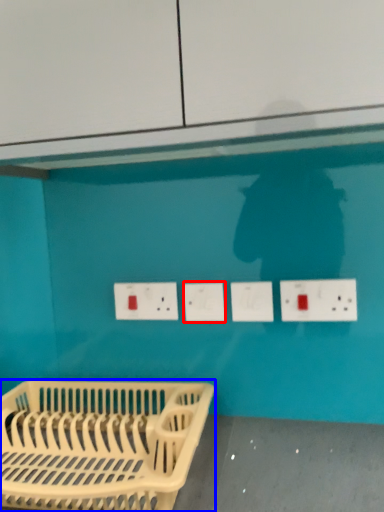
Question: Among these objects, which one is nearest to the camera, socket (highlighted by a red box) or furniture (highlighted by a blue box)?

Choices:
 (A) socket
 (B) furniture

Answer: (B)